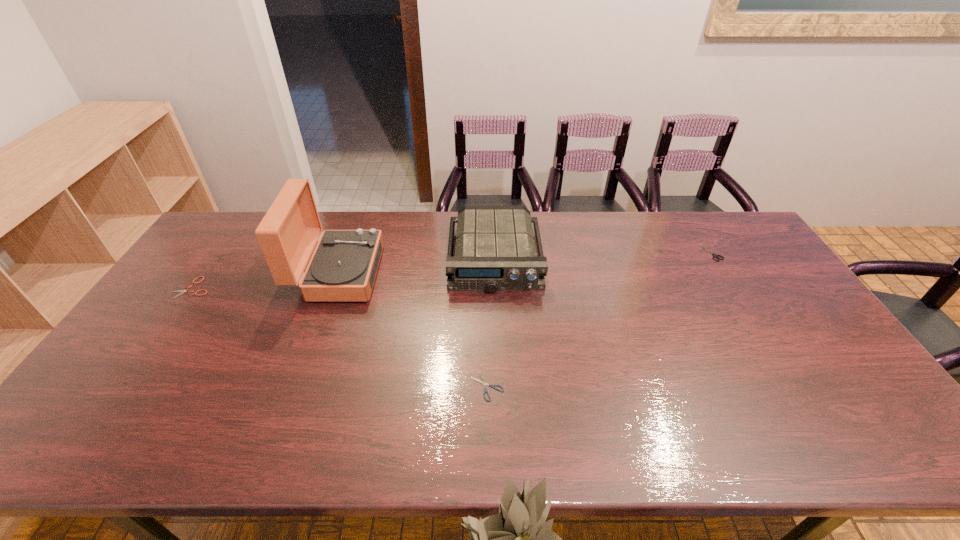
This screenshot has width=960, height=540. In order to click on free space that satisfies the following two spatial constraints: 1. on the face of the phonograph record; 2. on the right side of the nearest shears in this screenshot , I will do `click(298, 387)`.

Locate an element on the screen. The width and height of the screenshot is (960, 540). vacant area in the image that satisfies the following two spatial constraints: 1. on the back side of the shortest object; 2. on the face of the phonograph record is located at coordinates (486, 273).